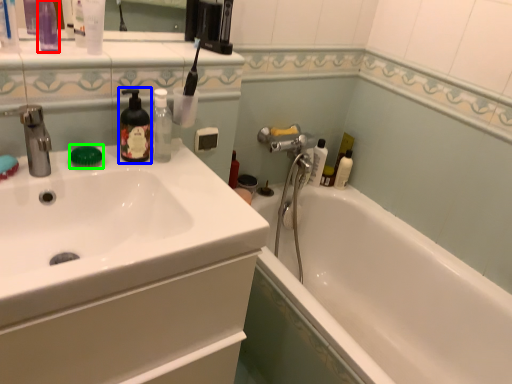
Question: Which is farther away from toiletry (highlighted by a red box)? soap dispenser (highlighted by a blue box) or soap (highlighted by a green box)?

Choices:
 (A) soap dispenser
 (B) soap

Answer: (B)